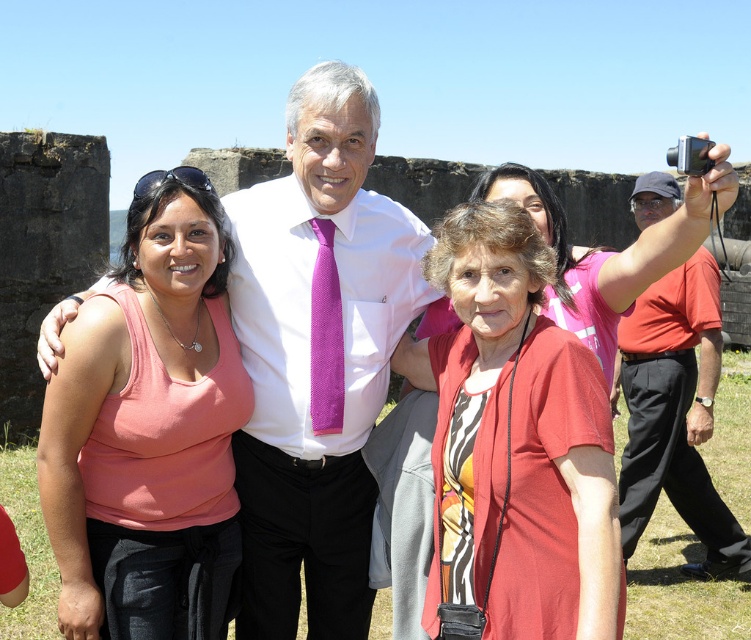
The height and width of the screenshot is (640, 751). What do you see at coordinates (149, 433) in the screenshot? I see `pink fabric tank top at left` at bounding box center [149, 433].

Between point (216, 292) and point (312, 321), which one is positioned in front?

Point (216, 292) is in front.

Is point (176, 458) less distant than point (321, 412)?

Yes.

Locate an element on the screen. pink fabric tank top at left is located at coordinates (149, 433).

Is point (198, 563) behind point (662, 186)?

No, (198, 563) is in front of (662, 186).

This screenshot has width=751, height=640. Find the location of `pink fabric tank top at left`. pink fabric tank top at left is located at coordinates (149, 433).

Where is `pink fabric tank top at left`? Image resolution: width=751 pixels, height=640 pixels. pink fabric tank top at left is located at coordinates (149, 433).

Is pink fabric tank top at left positioned in front of matte red shirt at center?

No, pink fabric tank top at left is behind matte red shirt at center.

Which is behind, point (59, 612) or point (508, 492)?

Positioned behind is point (59, 612).

Is point (148, 573) closer to camera compared to point (439, 522)?

Yes.

Identify the location of pink fabric tank top at left. (149, 433).